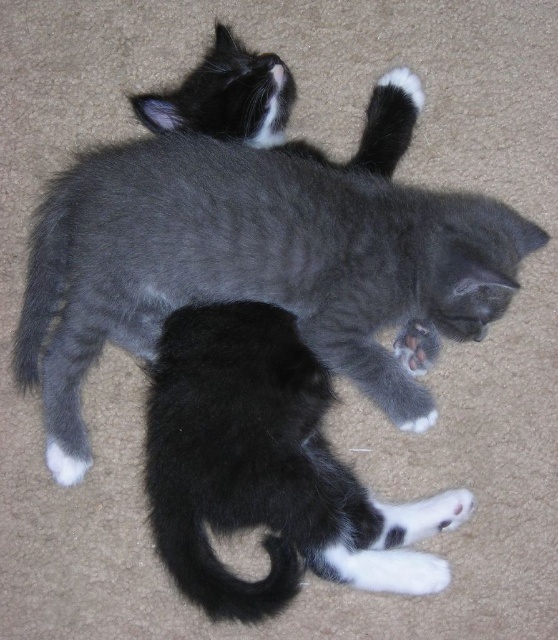
Which of these two, black soft fur kitten at center or white fur at lower center, stands taller?

Standing taller between the two is black soft fur kitten at center.

How far apart are black soft fur kitten at center and white fur at lower center?

The distance of black soft fur kitten at center from white fur at lower center is 12.38 inches.

Is point (271, 497) closer to viewer compared to point (431, 353)?

Yes.

The image size is (558, 640). I want to click on black soft fur kitten at center, so click(x=266, y=468).

Is point (222, 152) more distant than point (400, 358)?

No, (222, 152) is in front of (400, 358).

Can you confirm if soft gray fur cat at center is smaller than white fur at lower center?

No.

Which is behind, point (377, 264) or point (403, 356)?

The point (403, 356) is more distant.

The height and width of the screenshot is (640, 558). Find the location of `soft gray fur cat at center`. soft gray fur cat at center is located at coordinates (253, 266).

Is soft gray fur cat at center to the right of black soft fur kitten at center from the viewer's perspective?

No, soft gray fur cat at center is not to the right of black soft fur kitten at center.

You are a GUI agent. You are given a task and a screenshot of the screen. Output one action in this format:
    pyautogui.click(x=<x>, y=<y>)
    Task: Click on the soft gray fur cat at center
    The width and height of the screenshot is (558, 640).
    Given the screenshot: What is the action you would take?
    pyautogui.click(x=253, y=266)